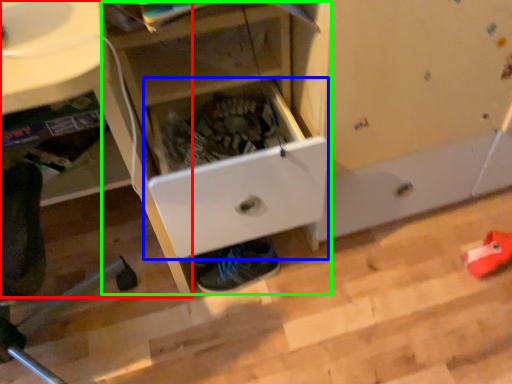
Question: Considering the real-world distances, which object is closest to computer desk (highlighted by a red box)? drawer (highlighted by a blue box) or cabinetry (highlighted by a green box).

Choices:
 (A) drawer
 (B) cabinetry

Answer: (B)